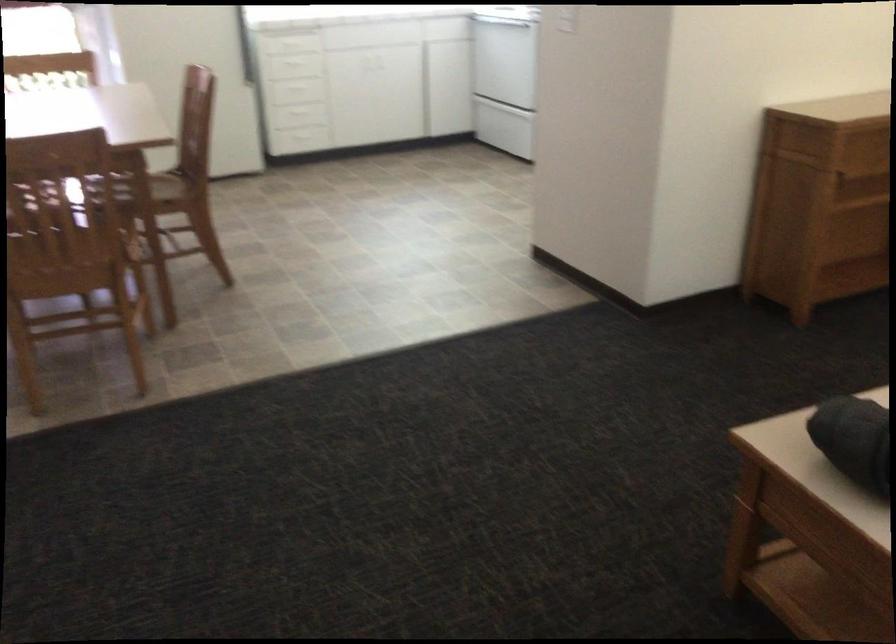
The first image is from the beginning of the video and the second image is from the end. How did the camera likely rotate when shooting the video?

The rotation direction of the camera is right-down.